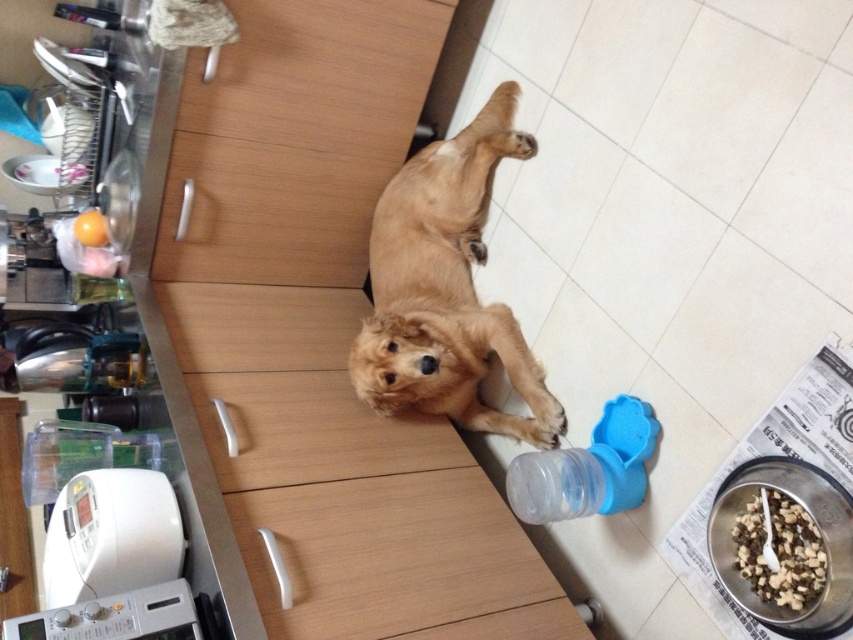
You are a pet owner who wants to place the smooth brown kibble at lower right near the golden fur dog at center. Since the dog is bigger, will the kibble be easy to see from above the dog?

The golden fur dog at center is bigger than smooth brown kibble at lower right, so the kibble might be partially obscured by the dog when viewed from above.

You are a pet owner who wants to give your dog a drink. You see the translucent plastic bottle at lower center and the smooth brown kibble at lower right. Which one should you use to provide water for your dog?

The translucent plastic bottle at lower center is much taller than the smooth brown kibble at lower right, so it is more likely to be a water container and should be used to provide water for your dog.